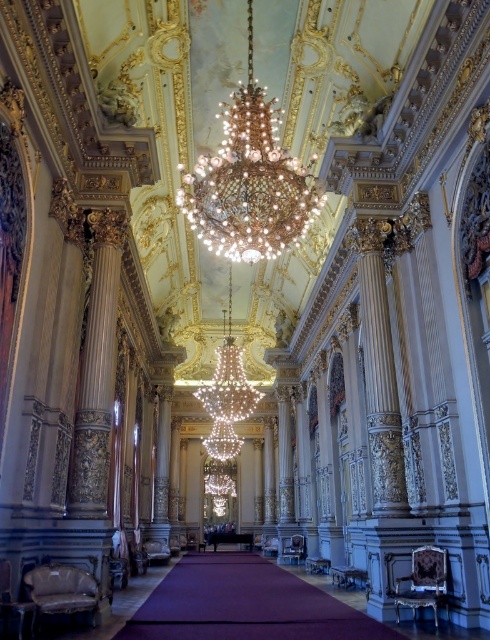
Is shiny crystal chandelier at center taller than white marble column at center?

No.

Does shiny crystal chandelier at center have a smaller size compared to white marble column at center?

No.

Who is more distant from viewer, (x=204, y=227) or (x=167, y=400)?

The point (x=167, y=400) is more distant.

The image size is (490, 640). What are the coordinates of `shiny crystal chandelier at center` in the screenshot? It's located at (249, 180).

Measure the distance between point (294, 211) and camera.

Point (294, 211) is 51.09 meters away from camera.

What do you see at coordinates (249, 180) in the screenshot?
I see `shiny crystal chandelier at center` at bounding box center [249, 180].

This screenshot has height=640, width=490. Identify the location of shiny crystal chandelier at center. (249, 180).

Does gold ornate column at center have a smaller size compared to white marble column at center?

Yes.

Consider the image. How far apart are gold ornate column at center and white marble column at center?

gold ornate column at center and white marble column at center are 67.75 meters apart.

Is point (382, 490) closer to camera compared to point (157, 436)?

Yes, point (382, 490) is closer to viewer.

Where is `gold ornate column at center`? This screenshot has height=640, width=490. gold ornate column at center is located at coordinates (378, 371).